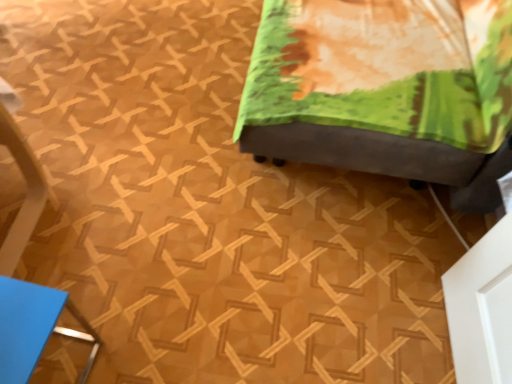
Locate an element on the screen. This screenshot has height=384, width=512. vacant space behind blue matte folder at lower left, the 1th furniture when ordered from left to right is located at coordinates (80, 283).